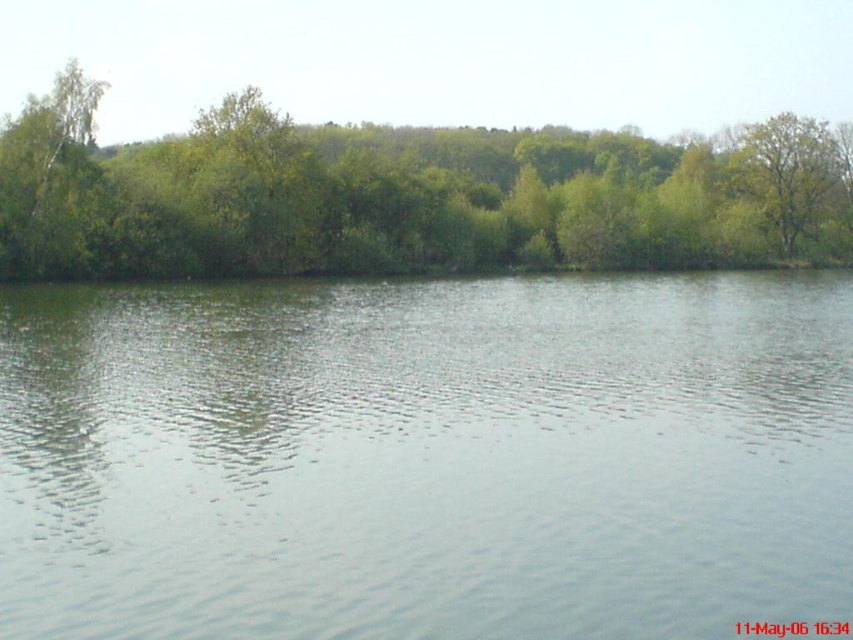
You are standing at the edge of the lake and want to walk to the base of the green leafy tree at upper center. The clear water at center is in between you and the tree. If your walking speed is 1.5 meters per second, how many seconds will it take you to reach the tree?

The distance between you and the green leafy tree at upper center is 60.94 meters. At a walking speed of 1.5 meters per second, it would take approximately 40.63 seconds to reach the tree.

You are standing on the shore looking at the scene. Which object is closer to you, the clear water at center or the green leafy tree at upper center?

The clear water at center is closer to you because it is in front of the green leafy tree at upper center.